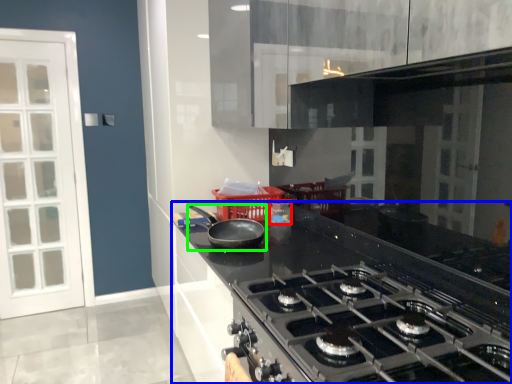
Question: Considering the real-world distances, which object is closest to appliance (highlighted by a red box)? countertop (highlighted by a blue box) or kitchen appliance (highlighted by a green box).

Choices:
 (A) countertop
 (B) kitchen appliance

Answer: (B)